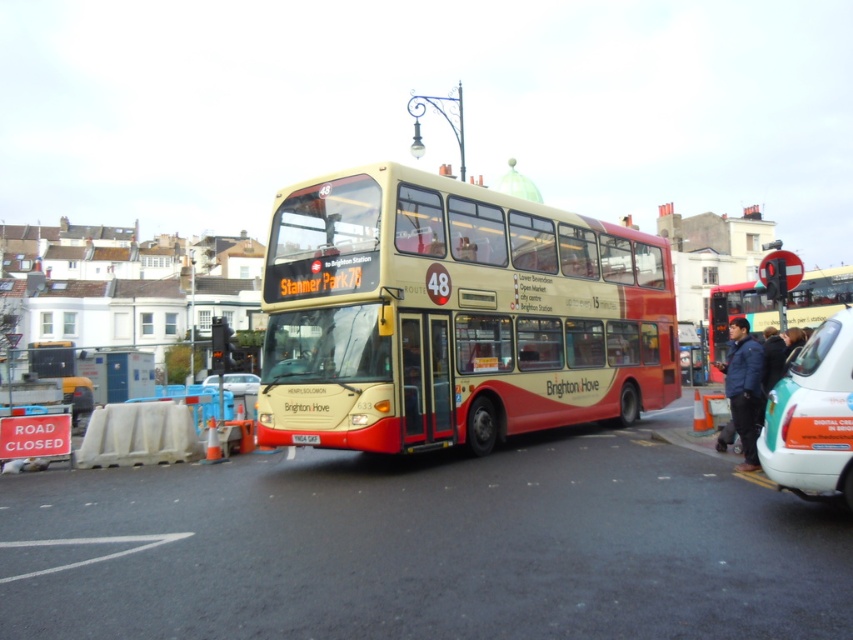
You are a delivery driver who needs to park your 6.5 meter long truck behind the matte gold bus at center. Can you safely park your truck without blocking the road closure sign on the left side?

The matte gold bus at center is 10.04 meters from the camera. Since your truck is 6.5 meters long, you can park behind it as long as there is sufficient space between the bus and the road closure sign. However, ensure that the truck does not encroach on the area near the sign to avoid blocking it.

You are a delivery driver who needs to pass through the road closure area. You have a tall delivery truck that is 4 meters in height. The road closure has a height restriction of 4.2 meters. Can your truck safely pass under the road closure area if you go through the path between the matte gold bus at center and the metallic silver car at center?

The matte gold bus at center is much taller than the metallic silver car at center. Since the road closure has a height restriction of 4.2 meters and your truck is 4 meters tall, your truck can safely pass under the road closure area as long as the height of the matte gold bus at center does not exceed the restriction. However, since the bus is only 4 meters tall, it would be safe. Wait, but the description says the bus is much taller than the car, but we don not know the exact height of the bus. The height

You are a pedestrian standing at the intersection and see the teal matte taxi at lower right and the metallic silver car at center. Which vehicle is positioned higher in the image?

The teal matte taxi at lower right is located above the metallic silver car at center in the image.